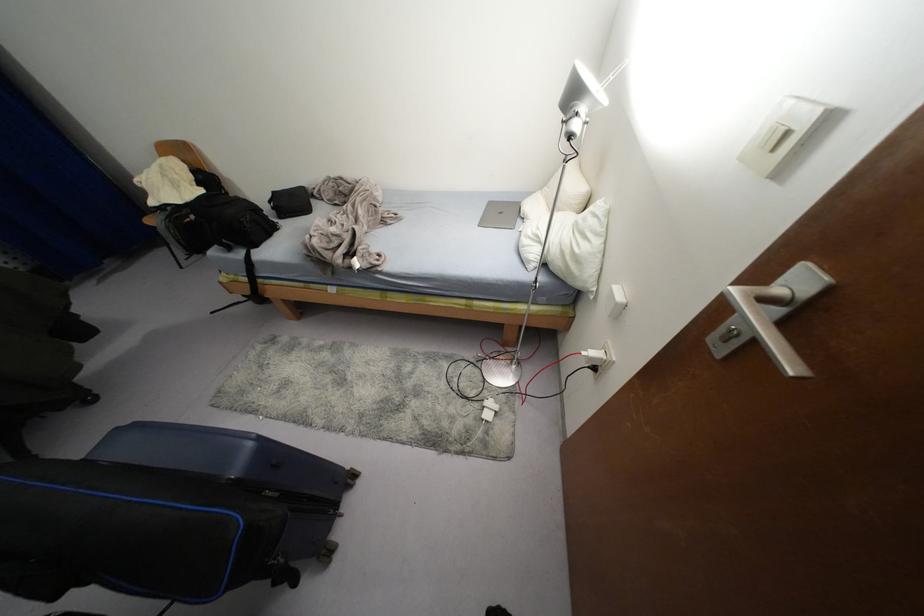
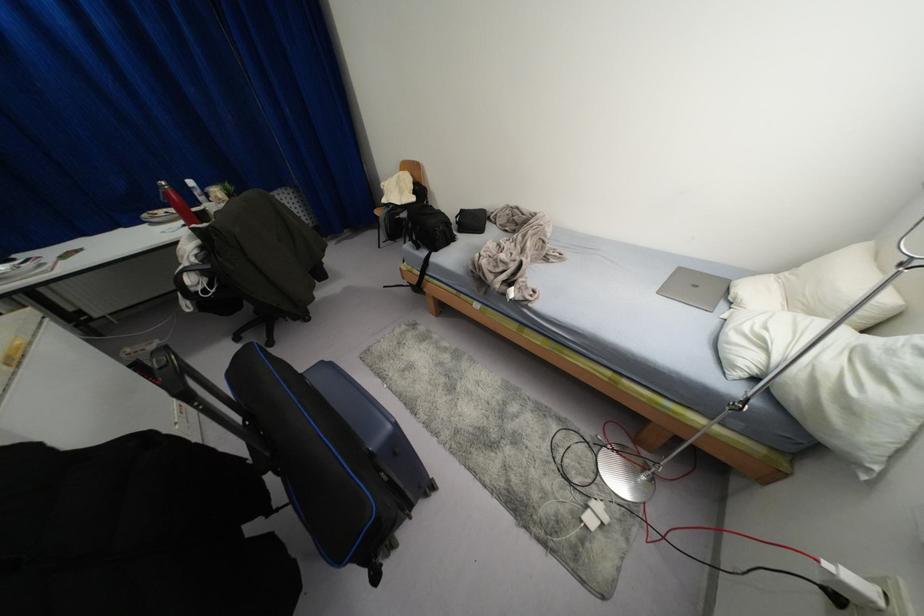
Question: The images are taken continuously from a first-person perspective. In which direction is your viewpoint rotating?

Choices:
 (A) Left
 (B) Right
 (C) Up
 (D) Down

Answer: (A)